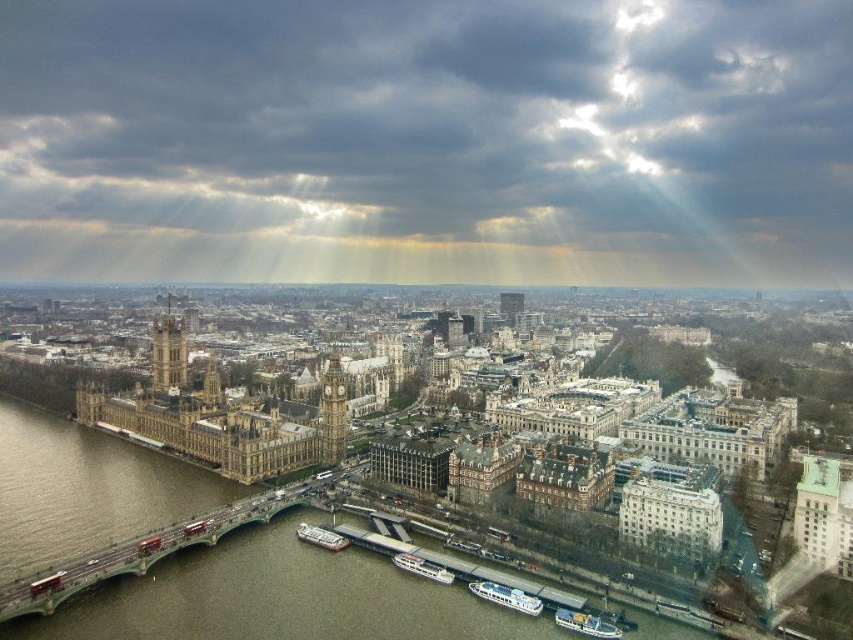
Which is in front, point (491, 593) or point (590, 616)?

Point (590, 616) is more forward.

Can you confirm if white matte boat at lower center is smaller than white plastic boat at lower right?

Incorrect, white matte boat at lower center is not smaller in size than white plastic boat at lower right.

Identify the location of white matte boat at lower center. (506, 596).

Between white plastic boat at lower right and white plastic boat at lower center, which one has less height?

white plastic boat at lower right is shorter.

Is white plastic boat at lower right wider than white plastic boat at lower center?

No.

You are a GUI agent. You are given a task and a screenshot of the screen. Output one action in this format:
    pyautogui.click(x=<x>, y=<y>)
    Task: Click on the white plastic boat at lower right
    
    Given the screenshot: What is the action you would take?
    pyautogui.click(x=585, y=624)

Does golden stone clock tower at center appear on the left side of white plastic boat at lower right?

Yes, golden stone clock tower at center is to the left of white plastic boat at lower right.

Is golden stone clock tower at center to the right of white plastic boat at lower right from the viewer's perspective?

Incorrect, golden stone clock tower at center is not on the right side of white plastic boat at lower right.

Describe the element at coordinates (332, 413) in the screenshot. The image size is (853, 640). I see `golden stone clock tower at center` at that location.

I want to click on golden stone clock tower at center, so click(332, 413).